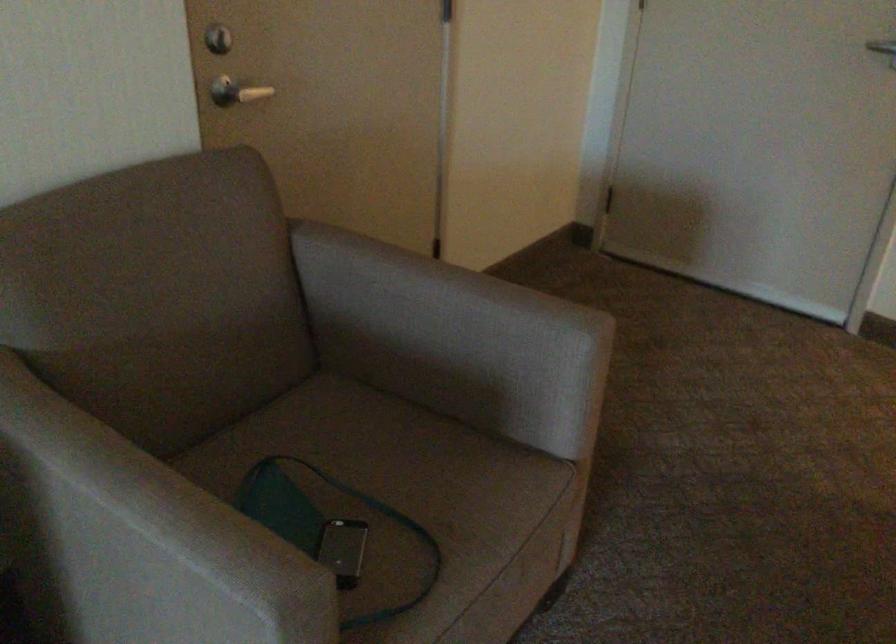
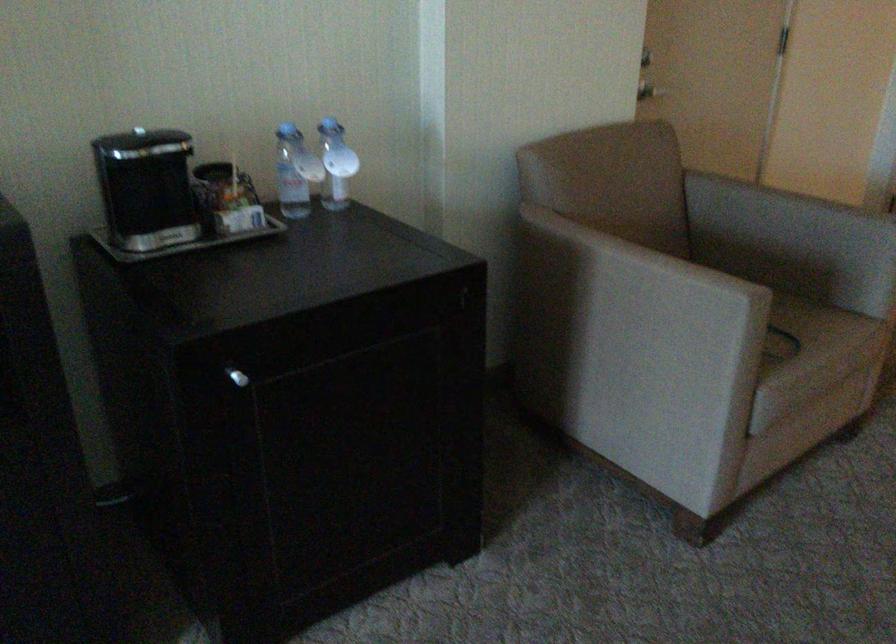
Question: I am providing you with two images of the same scene from different viewpoints. Which of the following objects are not visible in image2?

Choices:
 (A) dark paper cup
 (B) plastic water bottle
 (C) silver mobile phone
 (D) green gel bottle

Answer: (C)